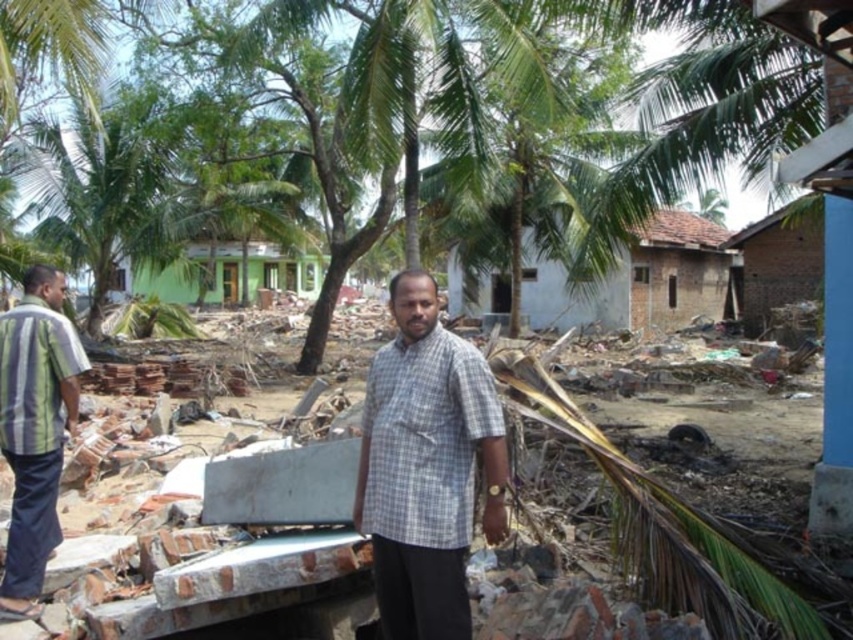
You are a rescue worker trying to navigate through the disaster area. You see the gray checkered shirt at center and the brown brick hut at upper right. Which object is wider from your perspective?

Answer: The brown brick hut at upper right is wider than the gray checkered shirt at center.

You are a rescue worker looking for survivors in the disaster area. You see a gray checkered shirt at center and a striped cotton shirt at left. Which shirt is positioned closer to the right side of the scene?

The gray checkered shirt at center is to the right of the striped cotton shirt at left, so the gray checkered shirt at center is positioned closer to the right side of the scene.